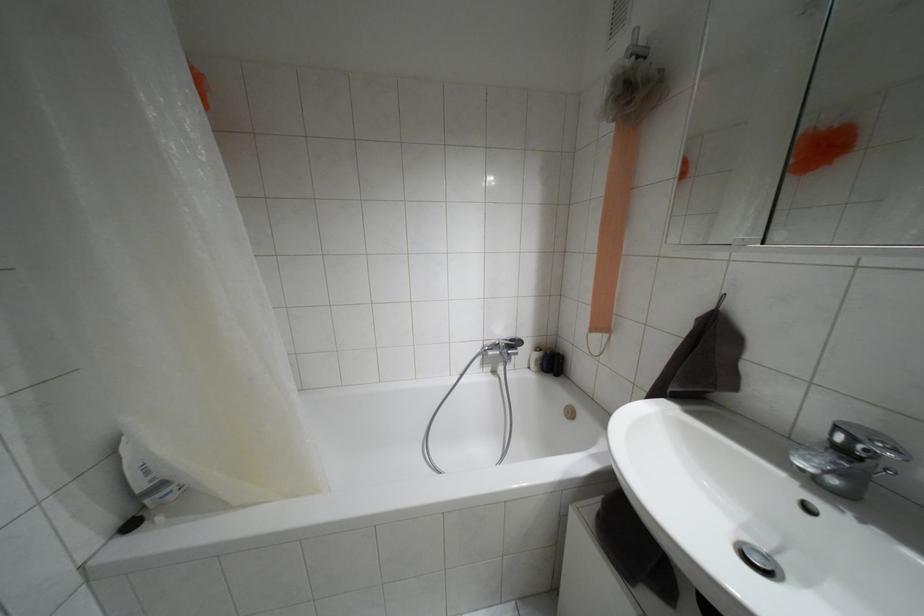
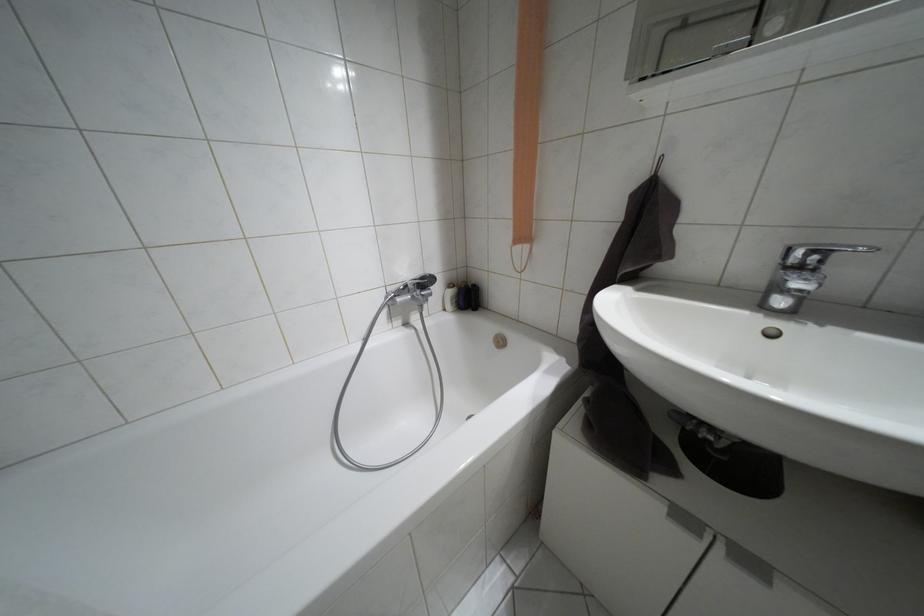
Find the pixel in the second image that matches (854,438) in the first image.

(810, 253)